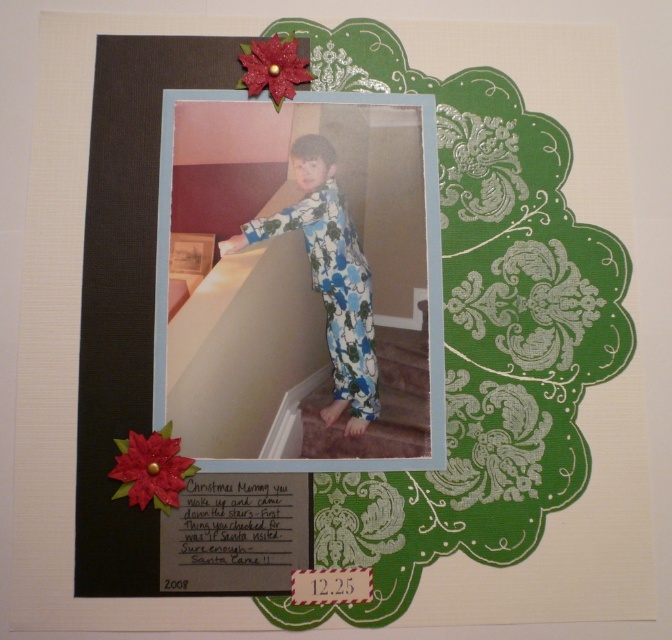
You are looking at a scrapbook layout with a photo of a child on a staircase. The layout has decorative elements like green scalloped paper on the right and a black strip on the left. There is a point marked at coordinates (378, 404). Based on the layout, what does this point most likely represent?

The point at (378, 404) marks the carpeted stairs at center.

You are looking at the scrapbook layout and want to place a sticker between the two points, point (x=425, y=339) and point (x=161, y=444). Which point should the sticker be closer to if you want it to appear in front of the other point?

The sticker should be placed closer to point (x=161, y=444) because point (x=425, y=339) is behind point (x=161, y=444), so placing the sticker near the front point will make it appear in front.